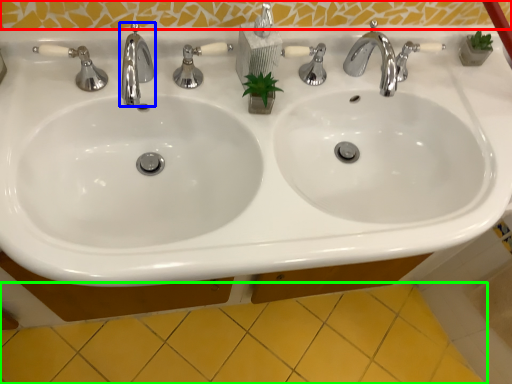
Question: Which is nearer to the mirror (highlighted by a red box)? tap (highlighted by a blue box) or ceramic tile (highlighted by a green box).

Choices:
 (A) tap
 (B) ceramic tile

Answer: (A)